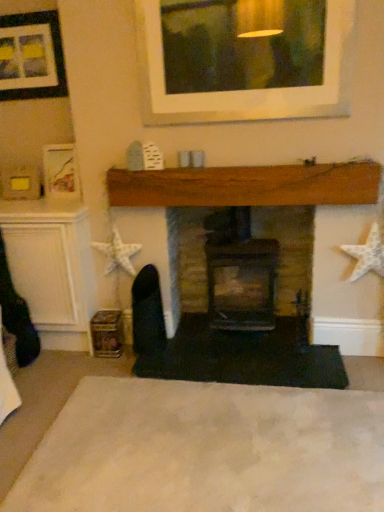
Find the location of a particular element. This screenshot has width=384, height=512. free space above wooden fireplace at center, which is the 1th fireplace in left-to-right order (from a real-world perspective) is located at coordinates (274, 154).